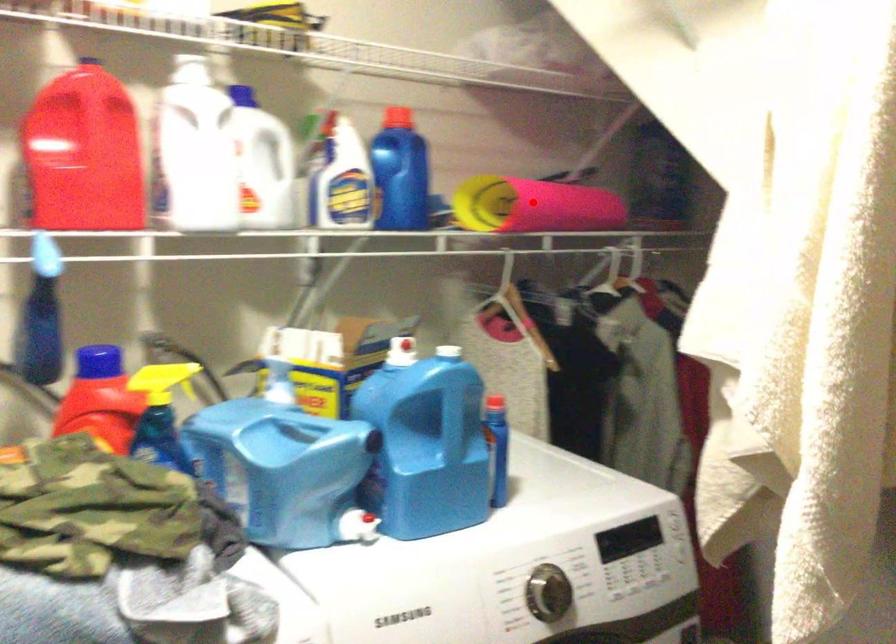
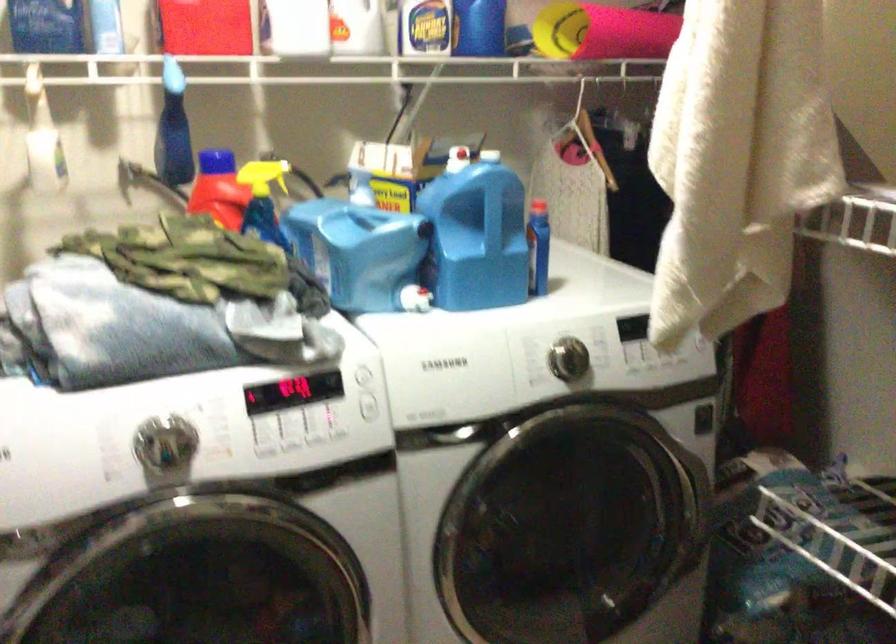
Locate, in the second image, the point that corresponds to the highlighted location in the first image.

(602, 32)